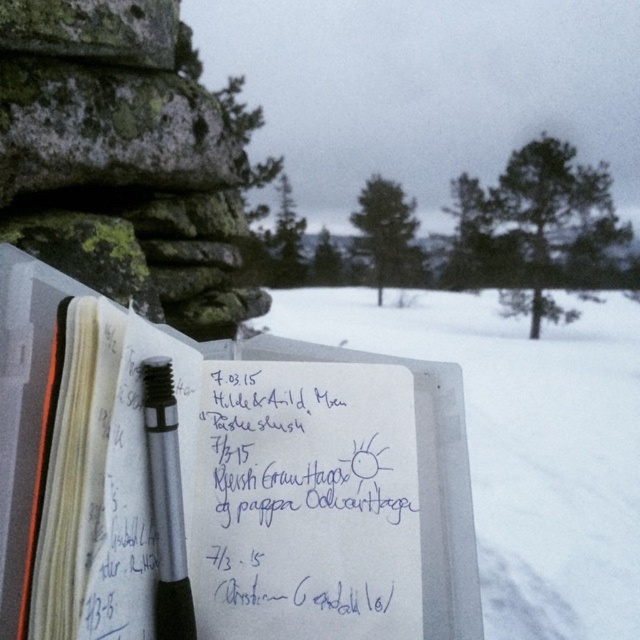
Question: Does white paper at center have a smaller size compared to blue ink writing at center?

Choices:
 (A) yes
 (B) no

Answer: (B)

Question: Which of the following is the closest to the observer?

Choices:
 (A) (150, 374)
 (B) (280, 593)
 (C) (362, 464)
 (D) (632, 412)

Answer: (A)

Question: Which object is farther from the camera taking this photo?

Choices:
 (A) silver metallic pen at center
 (B) white paper at center
 (C) white paper notebook at center

Answer: (B)

Question: Among these points, which one is nearest to the camera?

Choices:
 (A) 35,627
 (B) 412,625
 (C) 186,580
 (D) 611,380

Answer: (A)

Question: Can you confirm if white paper notebook at center is wider than blue ink writing at center?

Choices:
 (A) no
 (B) yes

Answer: (B)

Question: Is white paper notebook at center further to the viewer compared to blue ink writing at center?

Choices:
 (A) no
 (B) yes

Answer: (A)